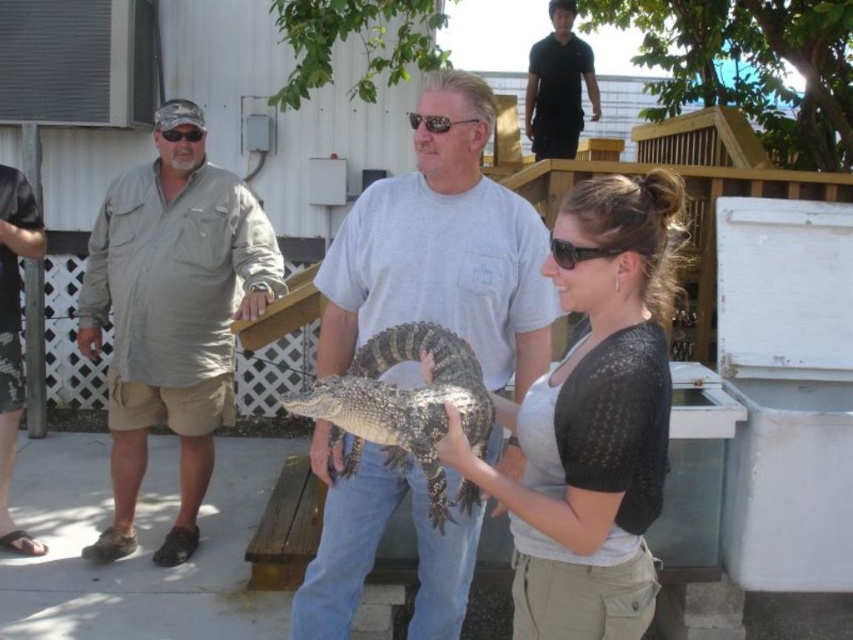
Is matte gray shirt at center shorter than khaki cotton shirt at left?

Indeed, matte gray shirt at center has a lesser height compared to khaki cotton shirt at left.

Does matte gray shirt at center have a smaller size compared to khaki cotton shirt at left?

Yes.

What do you see at coordinates (442, 248) in the screenshot? The width and height of the screenshot is (853, 640). I see `matte gray shirt at center` at bounding box center [442, 248].

Locate an element on the screen. matte gray shirt at center is located at coordinates (442, 248).

Does brushed metal shirt at left have a lesser height compared to black smooth shirt at upper center?

No, brushed metal shirt at left is not shorter than black smooth shirt at upper center.

Measure the distance between brushed metal shirt at left and black smooth shirt at upper center.

The distance of brushed metal shirt at left from black smooth shirt at upper center is 13.74 feet.

Is point (1, 388) less distant than point (549, 3)?

Yes, point (1, 388) is closer to viewer.

This screenshot has width=853, height=640. Find the location of `brushed metal shirt at left`. brushed metal shirt at left is located at coordinates pos(13,336).

Does slate textured alligator at center have a lesser height compared to black smooth shirt at upper center?

Yes, slate textured alligator at center is shorter than black smooth shirt at upper center.

Is slate textured alligator at center smaller than black smooth shirt at upper center?

Yes, slate textured alligator at center is smaller than black smooth shirt at upper center.

Between point (381, 428) and point (595, 81), which one is positioned in front?

Positioned in front is point (381, 428).

At what (x,y) coordinates should I click in order to perform the action: click on slate textured alligator at center. Please return your answer as a coordinate pair (x, y). The width and height of the screenshot is (853, 640). Looking at the image, I should click on (405, 406).